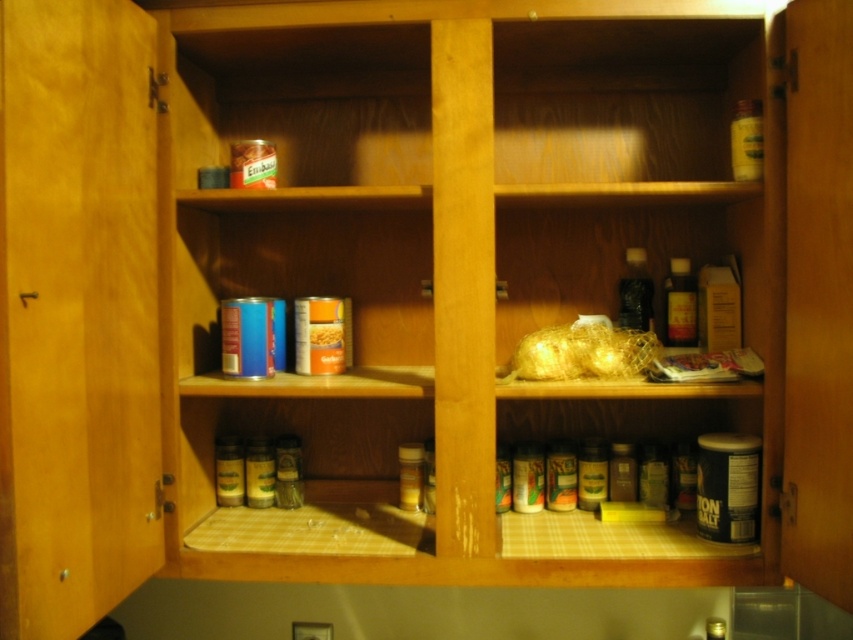
Question: Which point is farther to the camera?

Choices:
 (A) translucent amber glass bottle at upper right
 (B) black glass bottle at center-right

Answer: (B)

Question: Which point is farther to the camera?

Choices:
 (A) orange matte can at center
 (B) black glass bottle at center-right
 (C) translucent amber glass bottle at upper right
 (D) translucent plastic bottle at upper right

Answer: (B)

Question: Is black glass bottle at center-right to the right of orange matte can at center from the viewer's perspective?

Choices:
 (A) no
 (B) yes

Answer: (B)

Question: Among these objects, which one is farthest from the camera?

Choices:
 (A) orange matte can at center
 (B) translucent plastic bottle at upper right
 (C) translucent amber glass bottle at upper right
 (D) black glass bottle at center-right

Answer: (D)

Question: From the image, what is the correct spatial relationship of translucent plastic bottle at upper right in relation to black glass bottle at center-right?

Choices:
 (A) right
 (B) left

Answer: (A)

Question: Does translucent plastic bottle at upper right appear under black glass bottle at center-right?

Choices:
 (A) no
 (B) yes

Answer: (A)